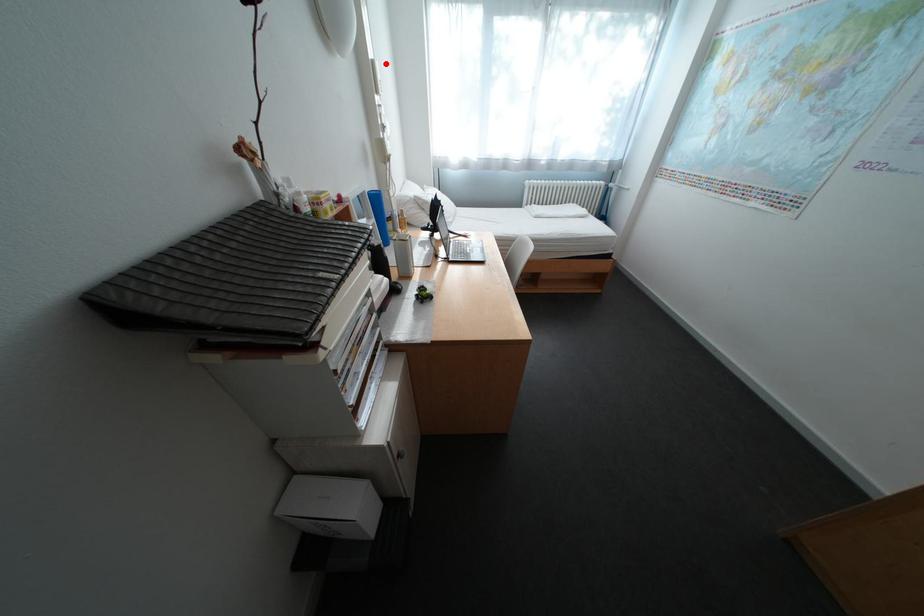
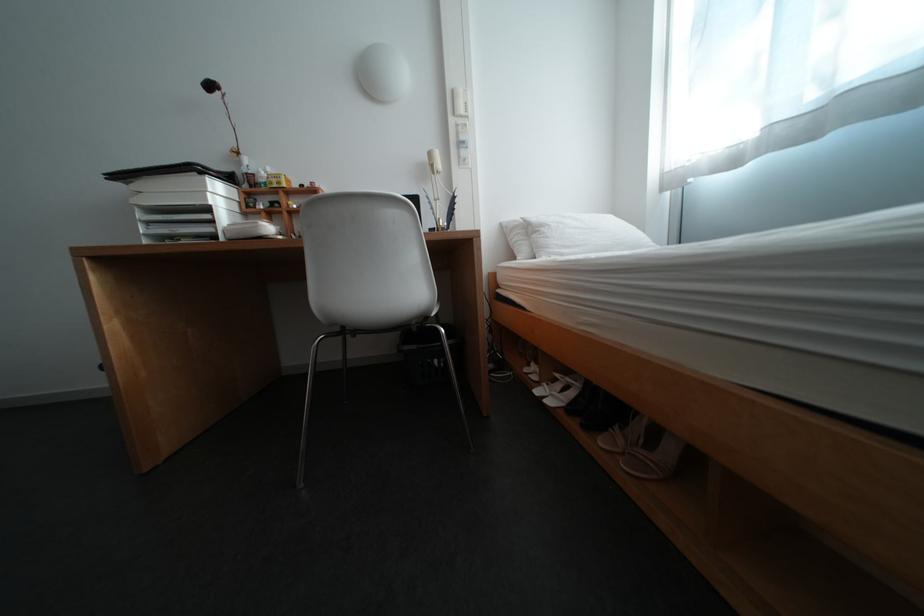
The point at the highlighted location is marked in the first image. Where is the corresponding point in the second image?

(466, 92)